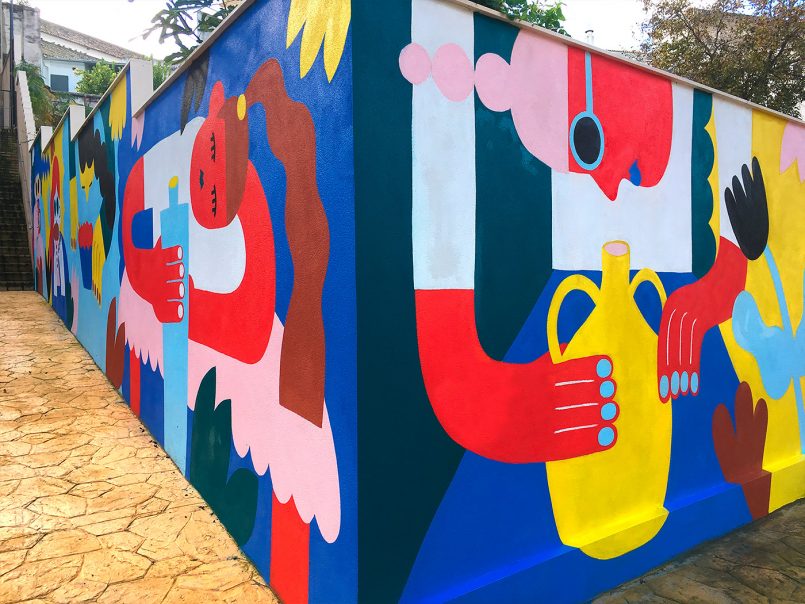
Identify the location of yellow jug. (638, 412).